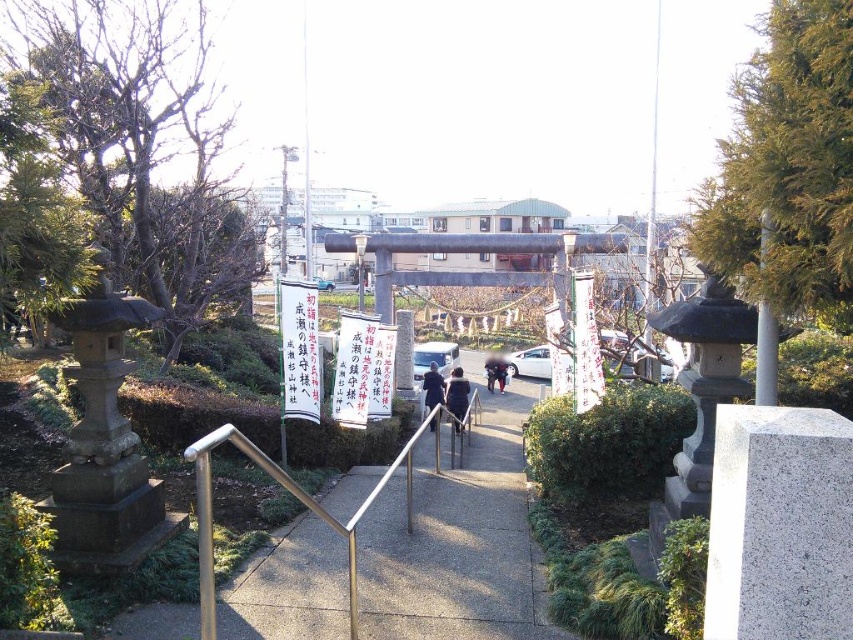
Question: Which object appears closest to the camera in this image?

Choices:
 (A) dark blue jacket at center
 (B) white glossy car at center

Answer: (B)

Question: Which object appears farthest from the camera in this image?

Choices:
 (A) metallic silver car at center
 (B) white glossy car at center
 (C) concrete pavement at center

Answer: (A)

Question: Is concrete pavement at center bigger than white glossy car at center?

Choices:
 (A) no
 (B) yes

Answer: (A)

Question: Does concrete pavement at center have a larger size compared to dark blue coat at center?

Choices:
 (A) no
 (B) yes

Answer: (B)

Question: In this image, where is concrete pavement at center located relative to dark blue jacket at center?

Choices:
 (A) right
 (B) left

Answer: (B)

Question: Based on their relative distances, which object is farther from the dark blue coat at center?

Choices:
 (A) concrete pavement at center
 (B) dark blue jacket at center

Answer: (A)